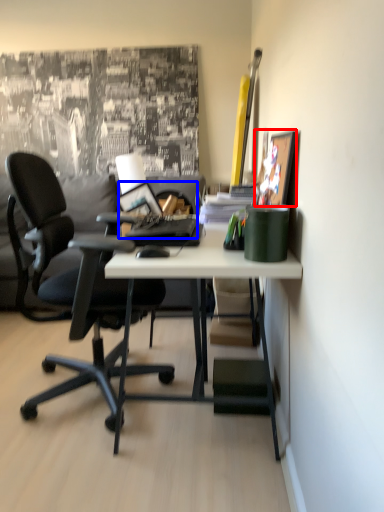
Question: Which of the following is the farthest to the observer, picture frame (highlighted by a red box) or laptop (highlighted by a blue box)?

Choices:
 (A) picture frame
 (B) laptop

Answer: (B)